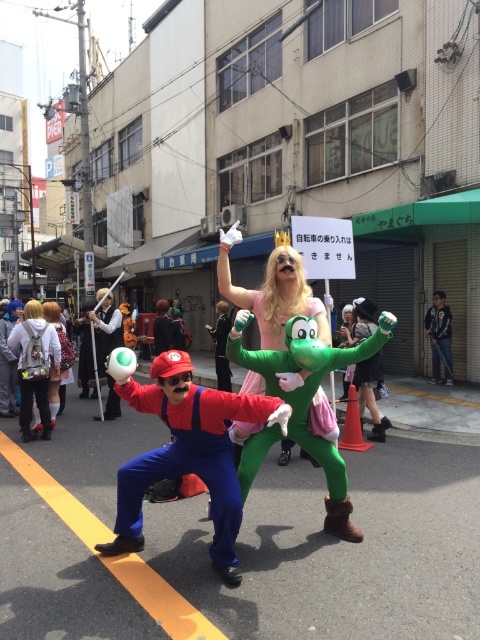
Question: Can you confirm if shiny silver sword at center is wider than green rubber boots at center?

Choices:
 (A) yes
 (B) no

Answer: (A)

Question: Does green rubber glove at center lie behind green rubber boots at center?

Choices:
 (A) no
 (B) yes

Answer: (A)

Question: Which of the following is the farthest from the observer?

Choices:
 (A) (130, 387)
 (B) (327, 467)
 (C) (343, 387)
 (D) (50, 396)

Answer: (C)

Question: Which point is closer to the camera?

Choices:
 (A) green matte luigi at center
 (B) green rubber boots at center
 (C) rubber mario at center

Answer: (A)

Question: In this image, where is green rubber glove at center located relative to shiny silver sword at center?

Choices:
 (A) right
 (B) left

Answer: (A)

Question: Among these objects, which one is farthest from the camera?

Choices:
 (A) white fabric dress at center
 (B) green rubber boots at center

Answer: (B)